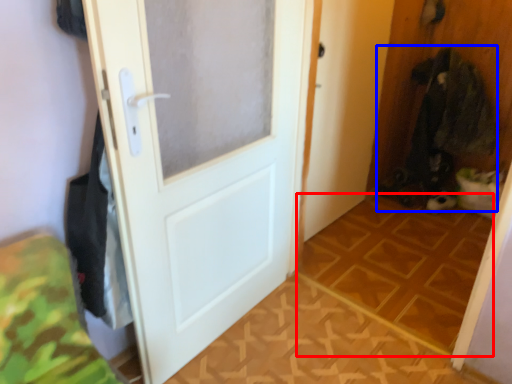
Question: Which point is closer to the camera, tile (highlighted by a red box) or laundry (highlighted by a blue box)?

Choices:
 (A) tile
 (B) laundry

Answer: (A)